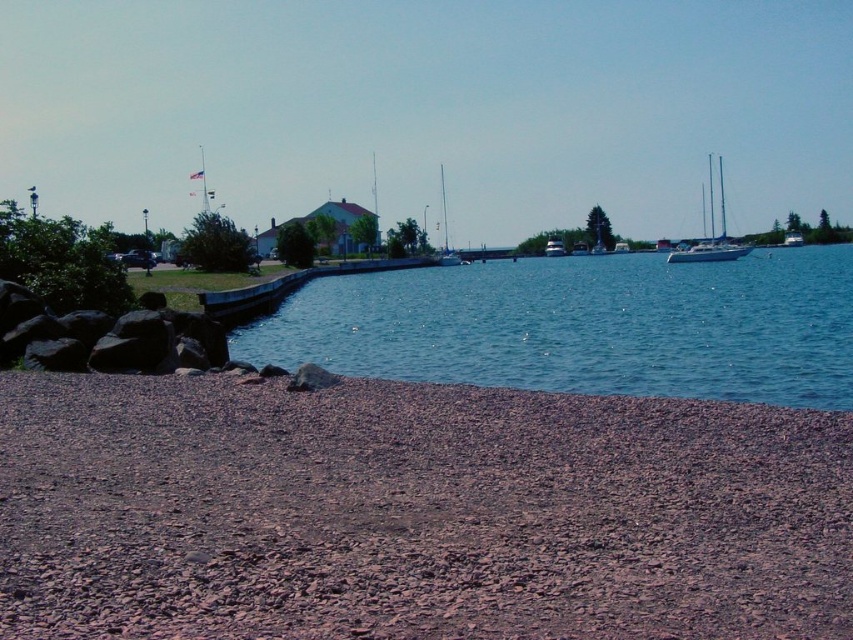
In the scene shown: Is white glossy sailboat at center to the right of white glossy sailboat at center-right from the viewer's perspective?

No, white glossy sailboat at center is not to the right of white glossy sailboat at center-right.

At what (x,y) coordinates should I click in order to perform the action: click on white glossy sailboat at center. Please return your answer as a coordinate pair (x, y). The width and height of the screenshot is (853, 640). Looking at the image, I should click on (445, 230).

The image size is (853, 640). What do you see at coordinates (711, 232) in the screenshot?
I see `white glossy sailboat at upper right` at bounding box center [711, 232].

Is white glossy sailboat at upper right positioned before white glossy sailboat at center?

That is True.

This screenshot has height=640, width=853. What do you see at coordinates (711, 232) in the screenshot?
I see `white glossy sailboat at upper right` at bounding box center [711, 232].

The height and width of the screenshot is (640, 853). In order to click on white glossy sailboat at upper right in this screenshot , I will do `click(711, 232)`.

Can you confirm if brown gravel beach at lower left is positioned to the left of green plastic boat at center?

Correct, you'll find brown gravel beach at lower left to the left of green plastic boat at center.

Does brown gravel beach at lower left appear over green plastic boat at center?

No, brown gravel beach at lower left is not above green plastic boat at center.

The height and width of the screenshot is (640, 853). What are the coordinates of `brown gravel beach at lower left` in the screenshot? It's located at (415, 513).